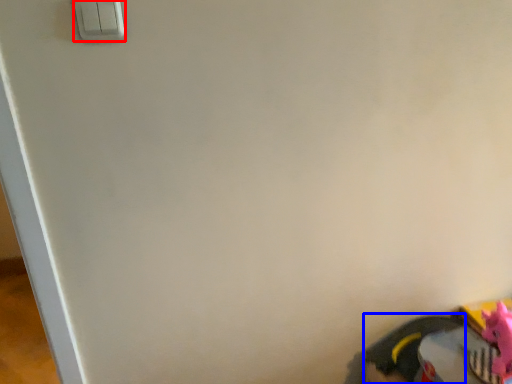
Question: Which object appears farthest to the camera in this image, light switch (highlighted by a red box) or footwear (highlighted by a blue box)?

Choices:
 (A) light switch
 (B) footwear

Answer: (B)